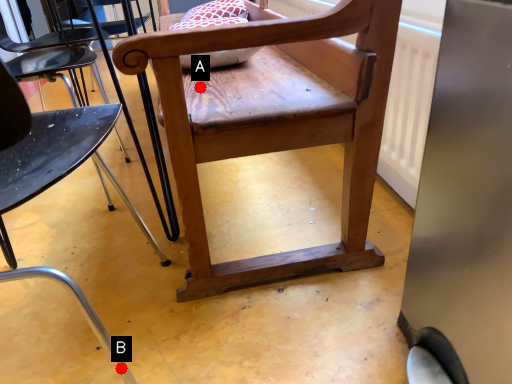
Question: Two points are circled on the image, labeled by A and B beside each circle. Among these points, which one is farthest from the camera?

Choices:
 (A) A is further
 (B) B is further

Answer: (A)